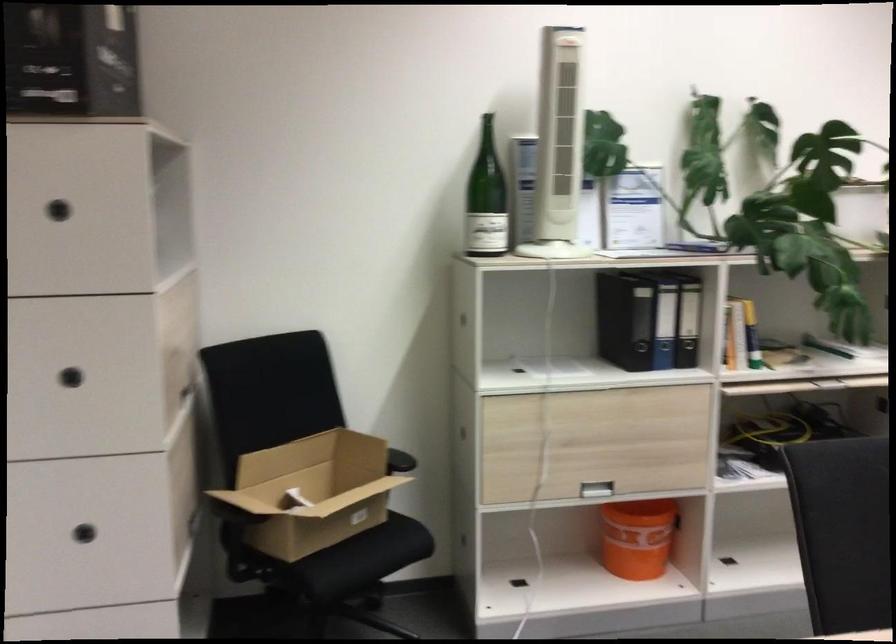
Where would you grasp the orange bucket? Please return your answer as a coordinate pair (x, y).

(636, 538)